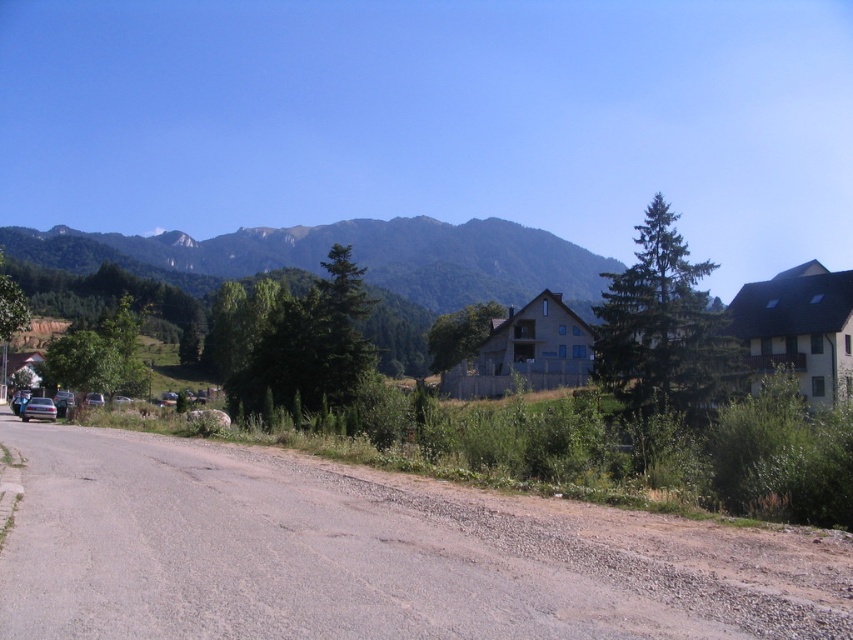
Question: Which of the following is the closest to the observer?

Choices:
 (A) green forested mountain at upper center
 (B) blue metallic motorcycle at left

Answer: (B)

Question: Can you confirm if dirt/gravel road at lower center is thinner than green forested mountain at upper center?

Choices:
 (A) no
 (B) yes

Answer: (B)

Question: From the image, what is the correct spatial relationship of dirt/gravel road at lower center in relation to green forested mountain at upper center?

Choices:
 (A) left
 (B) right

Answer: (A)

Question: Among these objects, which one is farthest from the camera?

Choices:
 (A) blue metallic motorcycle at left
 (B) green forested mountain at upper center

Answer: (B)

Question: Does green forested mountain at upper center have a larger size compared to blue metallic motorcycle at left?

Choices:
 (A) yes
 (B) no

Answer: (A)

Question: Based on their relative distances, which object is nearer to the blue metallic motorcycle at left?

Choices:
 (A) green forested mountain at upper center
 (B) dirt/gravel road at lower center

Answer: (B)